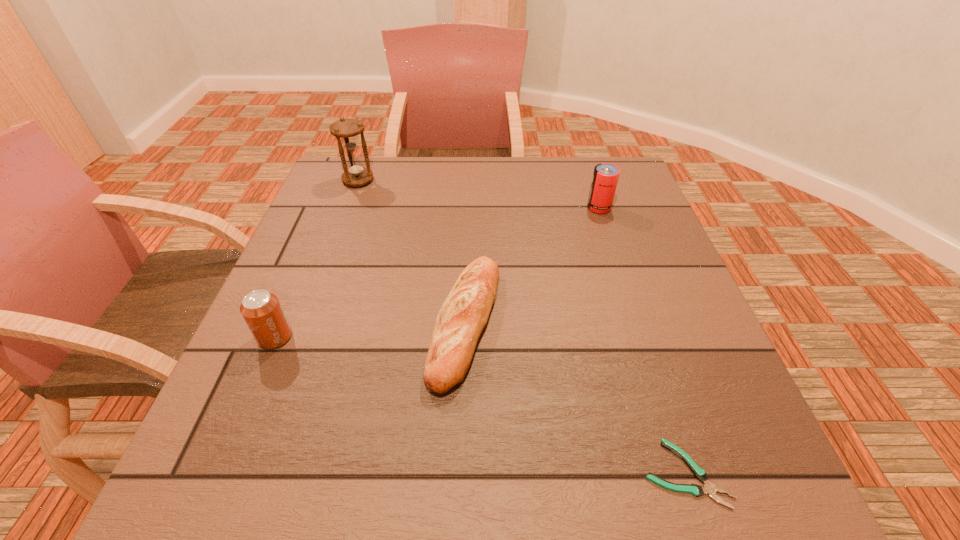
Identify the location of object that is the fourth closest one to the second shortest object. This screenshot has width=960, height=540. (346, 131).

Identify which object is the closest to the right can. Please provide its 2D coordinates. Your answer should be formatted as a tuple, i.e. [(x, y)], where the tuple contains the x and y coordinates of a point satisfying the conditions above.

[(464, 314)]

Identify the location of vacant space that satisfies the following two spatial constraints: 1. on the front side of the right can; 2. on the right side of the tallest object. Image resolution: width=960 pixels, height=540 pixels. (348, 208).

At what (x,y) coordinates should I click in order to perform the action: click on vacant region that satisfies the following two spatial constraints: 1. on the front side of the nearest object; 2. on the left side of the third object from right to left. Please return your answer as a coordinate pair (x, y). The image size is (960, 540). Looking at the image, I should click on (461, 473).